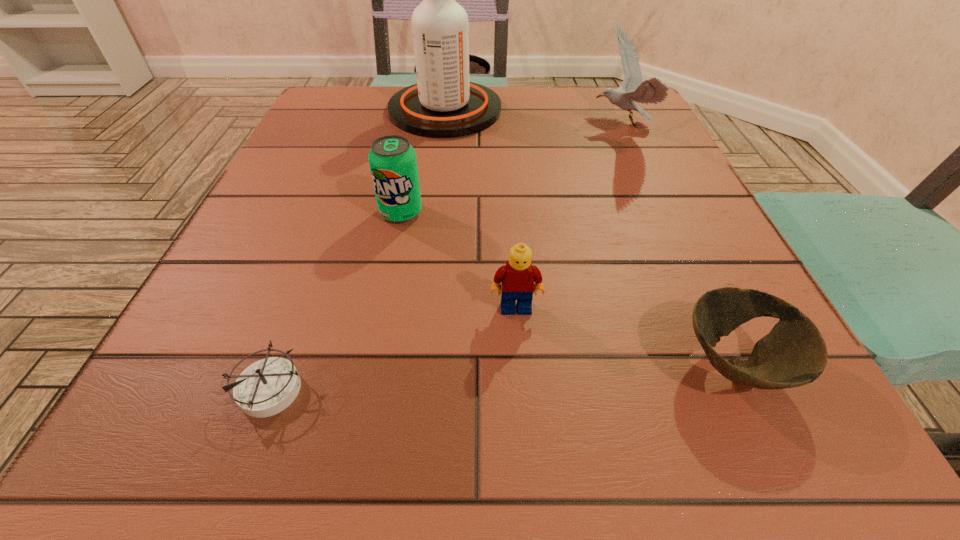
Identify the location of bowl at the right edge. The width and height of the screenshot is (960, 540). (794, 353).

You are a GUI agent. You are given a task and a screenshot of the screen. Output one action in this format:
    pyautogui.click(x=<x>, y=<y>)
    Task: Click on the object located at the near left corner
    
    Given the screenshot: What is the action you would take?
    pyautogui.click(x=268, y=386)

Image resolution: width=960 pixels, height=540 pixels. I want to click on object that is at the far right corner, so tap(652, 91).

You are a GUI agent. You are given a task and a screenshot of the screen. Output one action in this format:
    pyautogui.click(x=<x>, y=<y>)
    Task: Click on the object that is at the near right corner
    
    Given the screenshot: What is the action you would take?
    pyautogui.click(x=794, y=353)

In the image, there is a desktop. Identify the location of vacant space at the left edge. The height and width of the screenshot is (540, 960). (336, 256).

In the image, there is a desktop. Identify the location of vacant region at the right edge. The height and width of the screenshot is (540, 960). (620, 212).

Where is `vacant region at the far left corner of the desktop`? vacant region at the far left corner of the desktop is located at coordinates (357, 95).

In the image, there is a desktop. What are the coordinates of `vacant space at the far right corner` in the screenshot? It's located at (629, 126).

Locate an element on the screen. Image resolution: width=960 pixels, height=540 pixels. free space between the Lego and the compass is located at coordinates (394, 348).

You are a GUI agent. You are given a task and a screenshot of the screen. Output one action in this format:
    pyautogui.click(x=<x>, y=<y>)
    Task: Click on the free space between the fifth shortest object and the third farthest object
    
    Given the screenshot: What is the action you would take?
    pyautogui.click(x=511, y=169)